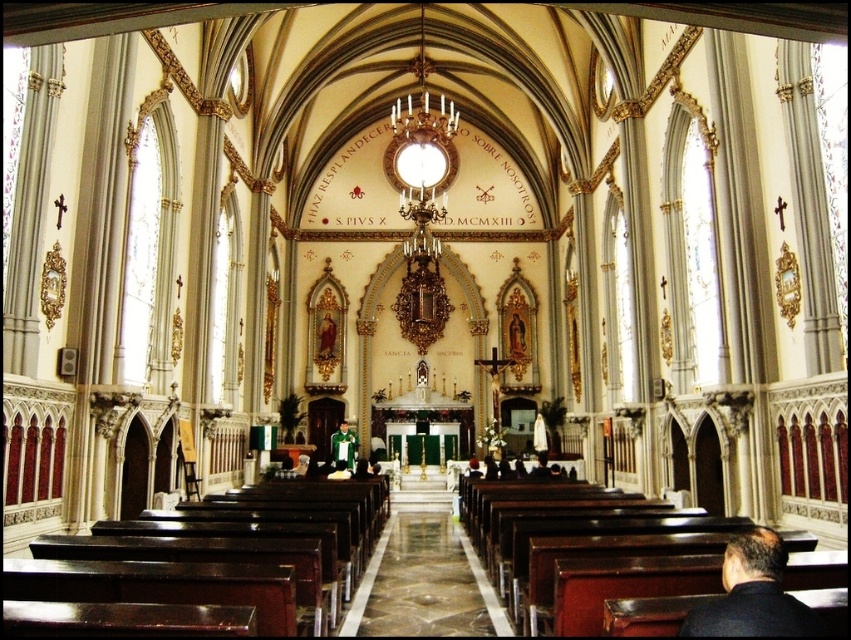
Question: Where is dark brown leather jacket at lower right located in relation to green velvet suit at center in the image?

Choices:
 (A) below
 (B) above

Answer: (B)

Question: Is dark brown leather jacket at lower right smaller than green velvet suit at center?

Choices:
 (A) no
 (B) yes

Answer: (B)

Question: Does dark brown leather jacket at lower right have a larger size compared to green velvet suit at center?

Choices:
 (A) yes
 (B) no

Answer: (B)

Question: Which point is farther from the camera taking this photo?

Choices:
 (A) (724, 564)
 (B) (351, 445)

Answer: (B)

Question: Which of the following is the closest to the observer?

Choices:
 (A) dark brown leather jacket at lower right
 (B) green velvet suit at center

Answer: (A)